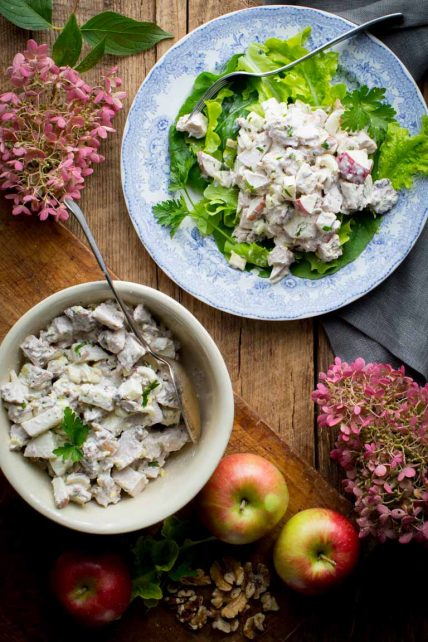
At what (x,y) coordinates should I click in order to perform the action: click on fork. Please return your answer as a coordinate pair (x, y). Looking at the image, I should click on (242, 73).